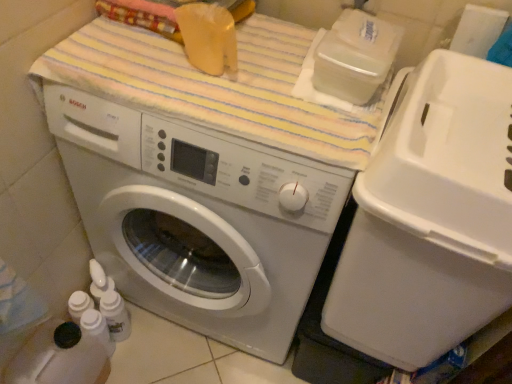
Question: Is point (464, 263) closer or farther from the camera than point (364, 119)?

Choices:
 (A) closer
 (B) farther

Answer: (A)

Question: Is white plastic water cooler at right inside the boundaries of striped cotton bath towel at upper center, or outside?

Choices:
 (A) outside
 (B) inside

Answer: (A)

Question: Which object is the farthest from the striped cotton bath towel at upper center?

Choices:
 (A) white glossy washing machine at center
 (B) white plastic water cooler at right

Answer: (B)

Question: Which is farther from the white glossy washing machine at center?

Choices:
 (A) white plastic water cooler at right
 (B) striped cotton bath towel at upper center

Answer: (A)